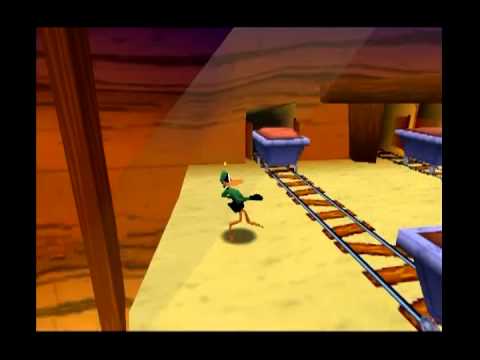
The image size is (480, 360). I want to click on size of wooden beam, so click(x=114, y=328), click(x=57, y=28).